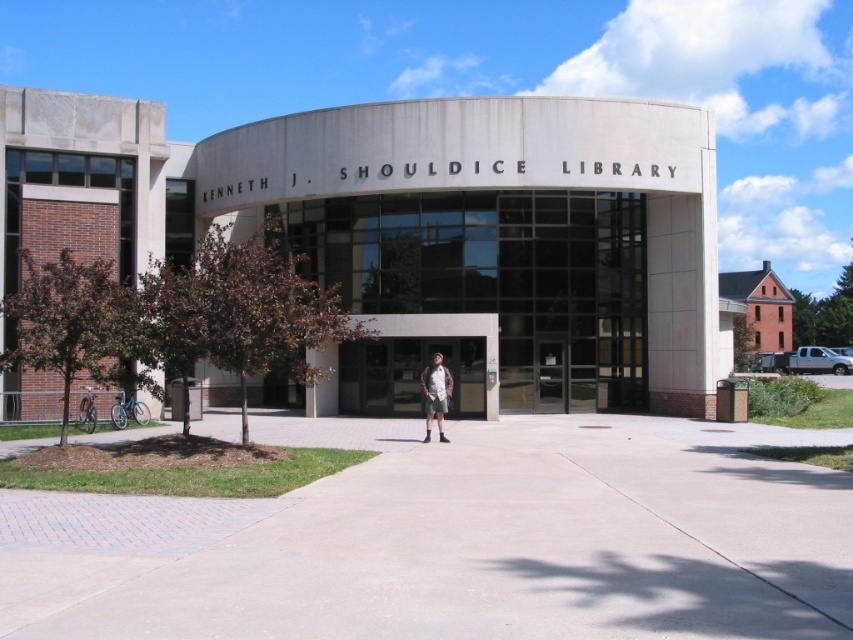
Question: Which point appears closest to the camera in this image?

Choices:
 (A) (431, 410)
 (B) (84, 540)

Answer: (B)

Question: Is concrete at center bigger than khaki shorts at center?

Choices:
 (A) yes
 (B) no

Answer: (A)

Question: Is concrete at center closer to the viewer compared to khaki shorts at center?

Choices:
 (A) no
 (B) yes

Answer: (B)

Question: Which of the following is the farthest from the observer?

Choices:
 (A) (444, 412)
 (B) (782, 465)

Answer: (A)

Question: Does concrete at center have a greater width compared to khaki shorts at center?

Choices:
 (A) no
 (B) yes

Answer: (B)